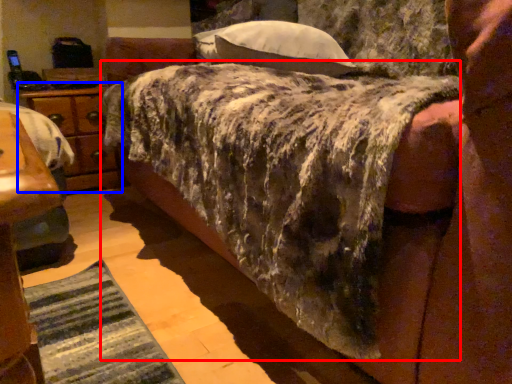
Question: Which object appears farthest to the camera in this image, mattress (highlighted by a red box) or nightstand (highlighted by a blue box)?

Choices:
 (A) mattress
 (B) nightstand

Answer: (B)